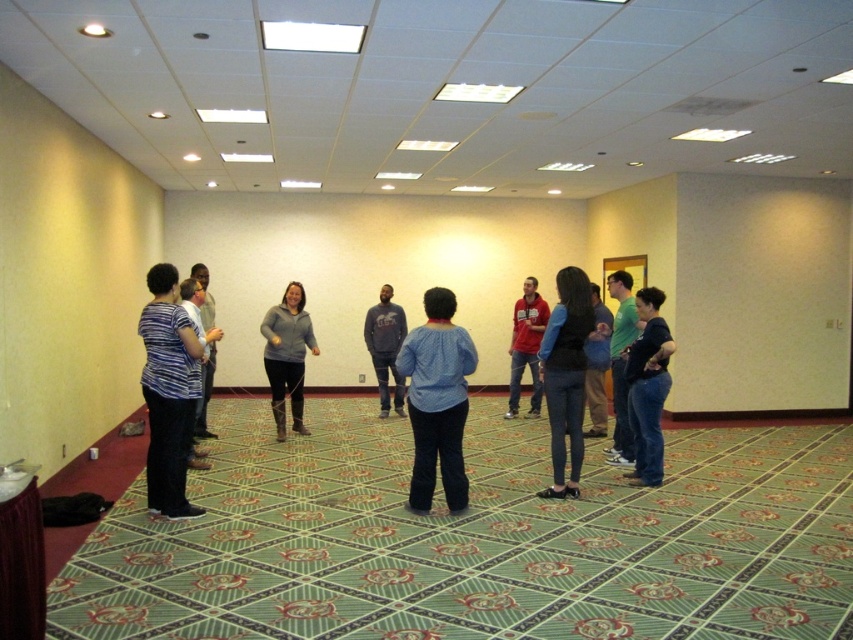
Question: Which object is farther from the camera taking this photo?

Choices:
 (A) blue cotton shirt at center
 (B) blue denim jeans at center

Answer: (B)

Question: Among these points, which one is nearest to the camera?

Choices:
 (A) (521, 320)
 (B) (387, 330)
 (C) (572, 289)

Answer: (C)

Question: Can you confirm if striped fabric shirt at left is thinner than blue jeans at lower right?

Choices:
 (A) yes
 (B) no

Answer: (B)

Question: Is blue denim jeans at center below blue jeans at lower right?

Choices:
 (A) yes
 (B) no

Answer: (B)

Question: Which object is farther from the camera taking this photo?

Choices:
 (A) light gray sweater at center
 (B) gray fleece jacket at center
 (C) blue cotton shirt at center

Answer: (B)

Question: Is green cotton shirt at center to the right of red cotton shirt at center from the viewer's perspective?

Choices:
 (A) no
 (B) yes

Answer: (B)